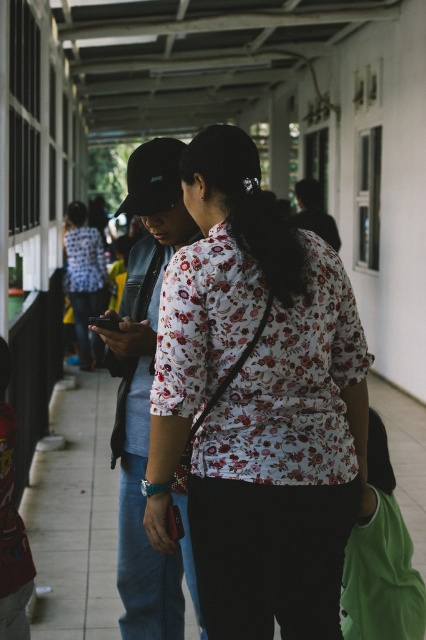
Question: Is white tile pavement at center smaller than green fabric bag at lower right?

Choices:
 (A) no
 (B) yes

Answer: (B)

Question: Can you confirm if white tile pavement at center is positioned below green fabric bag at lower right?

Choices:
 (A) no
 (B) yes

Answer: (B)

Question: Which object is positioned farthest from the white tile pavement at center?

Choices:
 (A) green fabric bag at lower right
 (B) floral fabric shirt at center

Answer: (B)

Question: Which point is closer to the camera?

Choices:
 (A) (39, 556)
 (B) (394, 538)
 (C) (209, 502)

Answer: (C)

Question: Which point is farther from the camera taking this photo?

Choices:
 (A) (279, 396)
 (B) (411, 582)
 (C) (42, 566)

Answer: (C)

Question: In this image, where is floral fabric shirt at center located relative to white tile pavement at center?

Choices:
 (A) below
 (B) above

Answer: (B)